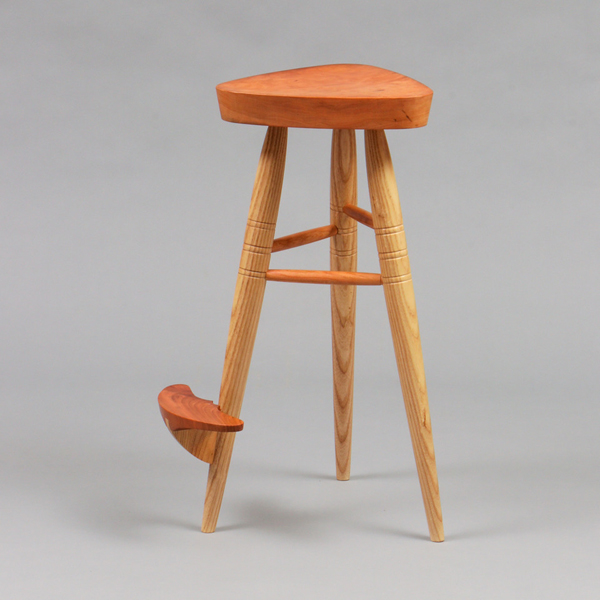
This screenshot has width=600, height=600. Identify the location of bottom leg. (210, 522).